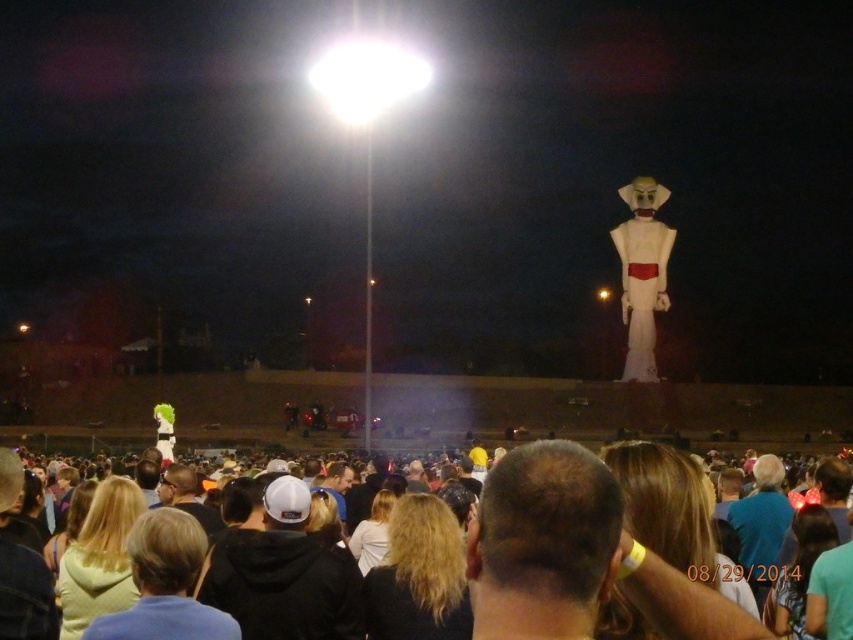
Is point (595, 612) farther from viewer compared to point (650, 253)?

No, it is in front of (650, 253).

Where is `dark brown hair at center`? This screenshot has width=853, height=640. dark brown hair at center is located at coordinates (607, 541).